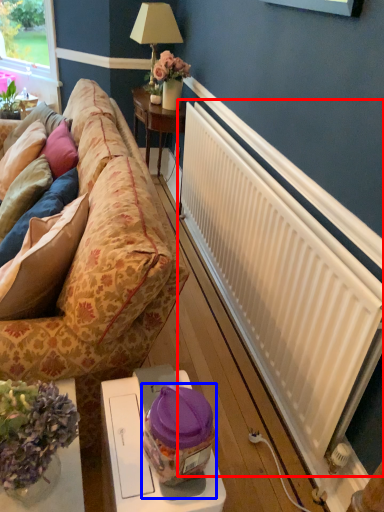
Question: Which object appears closest to the camera in this image, radiator (highlighted by a red box) or food (highlighted by a blue box)?

Choices:
 (A) radiator
 (B) food

Answer: (B)